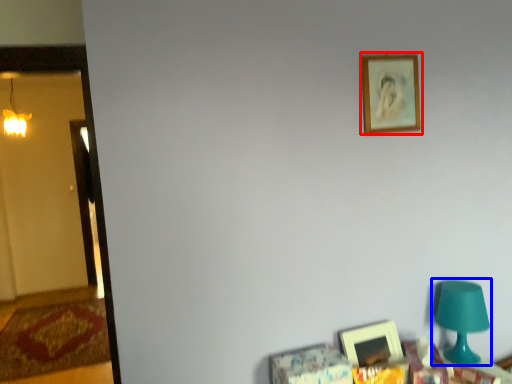
Question: Which of the following is the farthest to the observer, picture frame (highlighted by a red box) or table lamp (highlighted by a blue box)?

Choices:
 (A) picture frame
 (B) table lamp

Answer: (A)